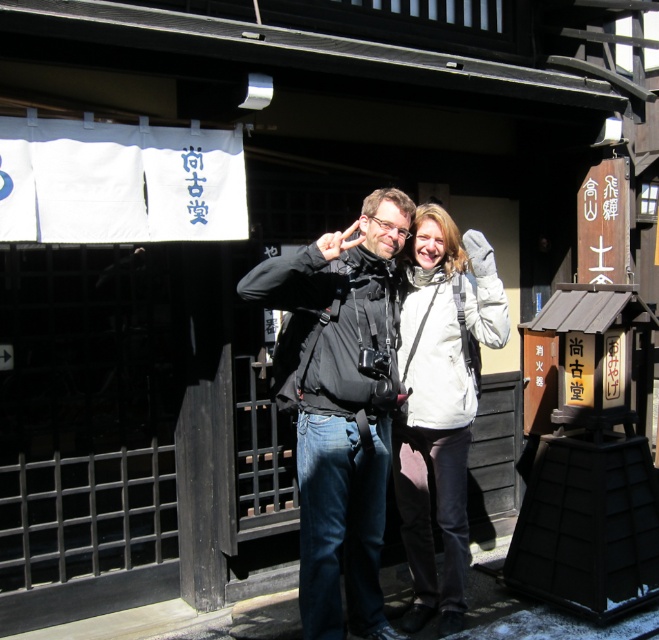
You are a photographer trying to capture a group photo of the two people wearing the black matte jacket at center and the white matte jacket at center. If you want to ensure both jackets are clearly visible in the photo, which jacket should you focus on first considering their widths?

The black matte jacket at center is wider than the white matte jacket at center, so focusing on the black matte jacket at center first would ensure both are clearly visible.

You are taking a photo of the two tourists wearing the black matte jacket at center and the white matte jacket at center in front of the traditional Japanese building. Which jacket appears higher in the photo?

The black matte jacket at center appears higher in the photo because it is located above the white matte jacket at center.